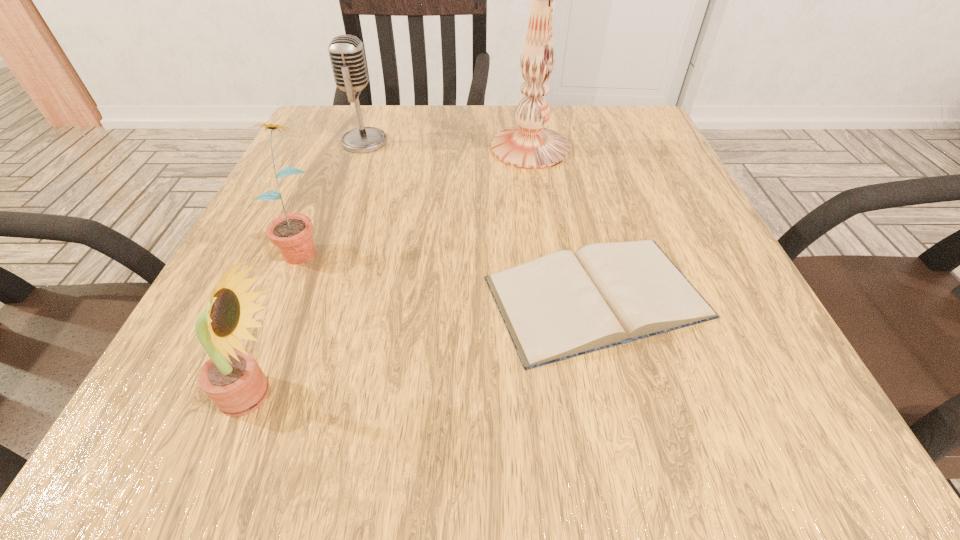
In order to click on lamp that is at the far edge in this screenshot , I will do `click(529, 145)`.

Where is `microphone situated at the far edge`? The width and height of the screenshot is (960, 540). microphone situated at the far edge is located at coordinates (346, 52).

You are a GUI agent. You are given a task and a screenshot of the screen. Output one action in this format:
    pyautogui.click(x=<x>, y=<y>)
    Task: Click on the object that is at the near edge
    The width and height of the screenshot is (960, 540).
    Given the screenshot: What is the action you would take?
    pyautogui.click(x=232, y=379)

The image size is (960, 540). What are the coordinates of `microphone present at the left edge` in the screenshot? It's located at pyautogui.click(x=346, y=52).

I want to click on lamp present at the right edge, so click(529, 145).

Find the location of `Bible that is at the right edge`. Bible that is at the right edge is located at coordinates (561, 305).

This screenshot has height=540, width=960. Find the location of `object located in the far left corner section of the desktop`. object located in the far left corner section of the desktop is located at coordinates (346, 52).

Locate an element on the screen. object at the near left corner is located at coordinates (232, 379).

The height and width of the screenshot is (540, 960). Find the location of `object located in the far right corner section of the desktop`. object located in the far right corner section of the desktop is located at coordinates (529, 145).

In the image, there is a desktop. Where is `free space at the far edge`? The width and height of the screenshot is (960, 540). free space at the far edge is located at coordinates click(x=423, y=109).